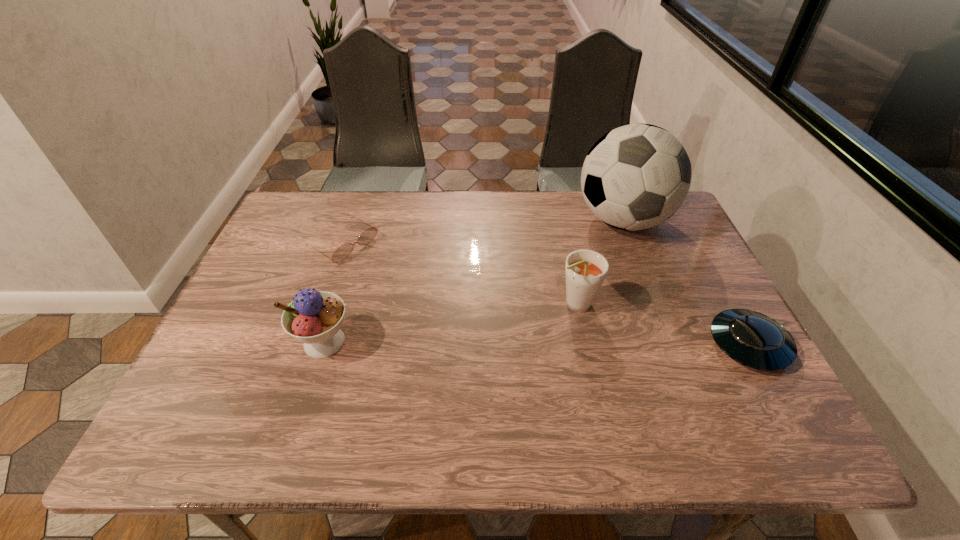
What are the coordinates of `saucer at the right edge` in the screenshot? It's located at (755, 340).

At what (x,y) coordinates should I click in order to perform the action: click on soccer ball present at the right edge. Please return your answer as a coordinate pair (x, y). The width and height of the screenshot is (960, 540). Looking at the image, I should click on (637, 176).

This screenshot has height=540, width=960. What are the coordinates of `object at the far left corner` in the screenshot? It's located at (341, 253).

At what (x,y) coordinates should I click in order to perform the action: click on object positioned at the far right corner. Please return your answer as a coordinate pair (x, y). Looking at the image, I should click on pyautogui.click(x=637, y=176).

The image size is (960, 540). Find the location of `object present at the near right corner`. object present at the near right corner is located at coordinates (755, 340).

Image resolution: width=960 pixels, height=540 pixels. I want to click on vacant space at the far edge, so click(x=402, y=221).

In the image, there is a desktop. Where is `free space at the near edge`? free space at the near edge is located at coordinates (451, 399).

You are a GUI agent. You are given a task and a screenshot of the screen. Output one action in this format:
    pyautogui.click(x=<x>, y=<y>)
    Task: Click on the free spot at the right edge of the desktop
    Image resolution: width=960 pixels, height=540 pixels.
    Given the screenshot: What is the action you would take?
    pyautogui.click(x=699, y=316)

You are a GUI agent. You are given a task and a screenshot of the screen. Output one action in this format:
    pyautogui.click(x=<x>, y=<y>)
    Task: Click on the free space at the far left corner of the desktop
    This screenshot has height=540, width=960.
    Given the screenshot: What is the action you would take?
    pyautogui.click(x=326, y=222)

This screenshot has width=960, height=540. I want to click on vacant space at the far right corner of the desktop, so click(x=679, y=233).